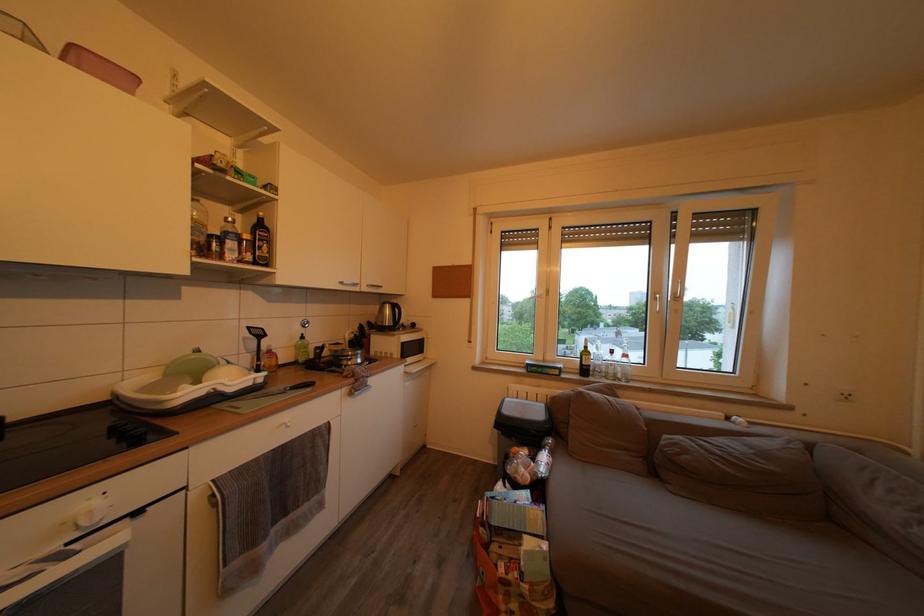
Locate an element on the screen. This screenshot has width=924, height=616. white oven dial is located at coordinates (91, 513).